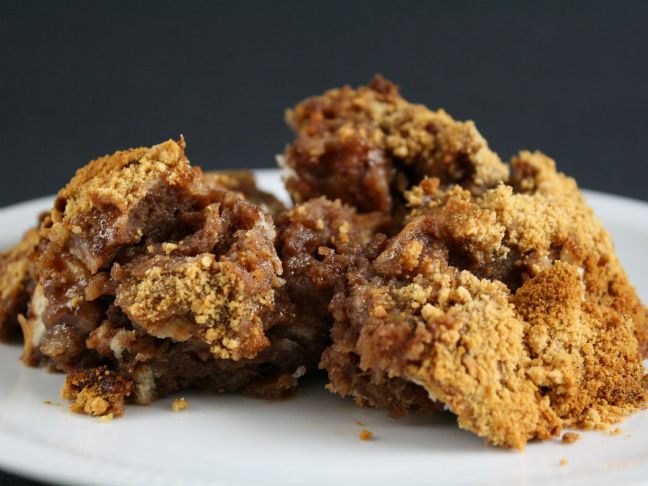
Identify the location of texture on plate. The width and height of the screenshot is (648, 486). (113, 469).